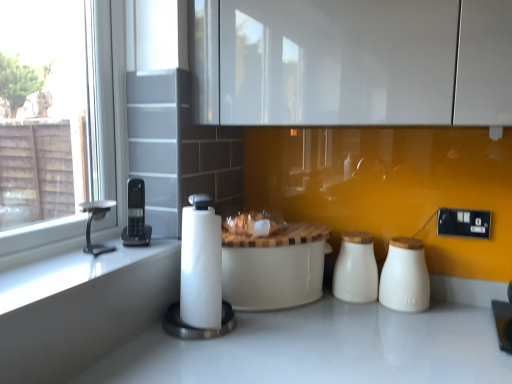
What do you see at coordinates (254, 223) in the screenshot? I see `translucent plastic bag at center` at bounding box center [254, 223].

This screenshot has width=512, height=384. Describe the element at coordinates (274, 267) in the screenshot. I see `white ceramic table at center` at that location.

I want to click on black plastic phone at left, the 1th appliance positioned from the left, so click(x=136, y=215).

Find the location of `black plastic electrical outlet at right`. black plastic electrical outlet at right is located at coordinates (463, 223).

The image size is (512, 384). Find the location of `silver metallic faucet at left`. silver metallic faucet at left is located at coordinates (96, 220).

Measure the distance between white ceramic salt shaker at right, which appears as the first salt shaker when viewed from the right, and camera.

white ceramic salt shaker at right, which appears as the first salt shaker when viewed from the right, is 1.22 meters from camera.

Image resolution: width=512 pixels, height=384 pixels. Describe the element at coordinates (405, 276) in the screenshot. I see `white ceramic salt shaker at right, arranged as the 2th salt shaker when viewed from the left` at that location.

What are the coordinates of `translucent plastic bag at center` in the screenshot? It's located at (254, 223).

Is silver metallic faucet at left located outside white ceramic table at center?

Yes.

At what (x,y) coordinates should I click in order to perform the action: click on table below the silver metallic faucet at left (from the image's perspective). Please return your answer as a coordinate pair (x, y). Looking at the image, I should click on (274, 267).

Is silver metallic faucet at left positioned in front of white ceramic table at center?

Yes, silver metallic faucet at left is closer to the viewer.

From the image's perspective, is silver metallic faucet at left positioned above or below white ceramic table at center?

silver metallic faucet at left is situated higher than white ceramic table at center in the image.

Would you say black plastic electrical outlet at right is part of white ceramic table at center's contents?

Definitely not — black plastic electrical outlet at right is not inside white ceramic table at center.

From the image's perspective, is white ceramic table at center above or below black plastic electrical outlet at right?

Based on their image positions, white ceramic table at center is located beneath black plastic electrical outlet at right.

Is white ceramic table at center closer to the viewer compared to black plastic electrical outlet at right?

Yes, white ceramic table at center is closer to the viewer.

Does white ceramic table at center appear on the right side of black plastic electrical outlet at right?

In fact, white ceramic table at center is to the left of black plastic electrical outlet at right.

Is translucent plastic bag at center not close to white paper towel at center, the first appliance viewed from the right?

No, there isn't a large distance between translucent plastic bag at center and white paper towel at center, the first appliance viewed from the right.

Which appliance is the 1st one when counting from the left side of the translucent plastic bag at center? Please provide its 2D coordinates.

[(200, 277)]

Would you say translucent plastic bag at center is outside white paper towel at center, the first appliance viewed from the right?

translucent plastic bag at center is positioned outside white paper towel at center, the first appliance viewed from the right.

Considering the relative positions of translucent plastic bag at center and white paper towel at center, the 2th appliance when ordered from left to right, in the image provided, is translucent plastic bag at center to the left or to the right of white paper towel at center, the 2th appliance when ordered from left to right,?

Based on their positions, translucent plastic bag at center is located to the right of white paper towel at center, the 2th appliance when ordered from left to right.

Image resolution: width=512 pixels, height=384 pixels. I want to click on food that appears below the black plastic phone at left, the 1th appliance positioned from the left (from the image's perspective), so click(x=254, y=223).

Considering the positions of point (260, 233) and point (133, 226), is point (260, 233) closer or farther from the camera than point (133, 226)?

Point (260, 233).

From a real-world perspective, is translucent plastic bag at center above or below black plastic phone at left, the 1th appliance positioned from the left?

From a real-world perspective, translucent plastic bag at center is physically below black plastic phone at left, the 1th appliance positioned from the left.

Considering the relative sizes of translucent plastic bag at center and black plastic phone at left, the 1th appliance positioned from the left, in the image provided, is translucent plastic bag at center shorter than black plastic phone at left, the 1th appliance positioned from the left,?

Yes, translucent plastic bag at center is shorter than black plastic phone at left, the 1th appliance positioned from the left.

Looking at their sizes, would you say black plastic phone at left, which is the 2th appliance from right to left, is wider or thinner than white ceramic salt shaker at right, arranged as the 2th salt shaker when viewed from the left?

In the image, black plastic phone at left, which is the 2th appliance from right to left, appears to be more narrow than white ceramic salt shaker at right, arranged as the 2th salt shaker when viewed from the left.

Based on the photo, between black plastic phone at left, which is the 2th appliance from right to left, and white ceramic salt shaker at right, which appears as the first salt shaker when viewed from the right, which one has less height?

black plastic phone at left, which is the 2th appliance from right to left.

Is point (143, 189) positioned before point (415, 260)?

That is True.

From the image's perspective, which one is positioned higher, white ceramic table at center or white ceramic salt shaker at right, arranged as the 2th salt shaker when viewed from the left?

white ceramic salt shaker at right, arranged as the 2th salt shaker when viewed from the left, appears higher in the image.

Considering the sizes of white ceramic table at center and white ceramic salt shaker at right, arranged as the 2th salt shaker when viewed from the left, in the image, is white ceramic table at center taller or shorter than white ceramic salt shaker at right, arranged as the 2th salt shaker when viewed from the left,?

Considering their sizes, white ceramic table at center has more height than white ceramic salt shaker at right, arranged as the 2th salt shaker when viewed from the left.

In the scene shown: What's the angular difference between white ceramic table at center and white ceramic salt shaker at right, which appears as the first salt shaker when viewed from the right,'s facing directions?

40.5 degrees separate the facing orientations of white ceramic table at center and white ceramic salt shaker at right, which appears as the first salt shaker when viewed from the right.

Does point (272, 290) appear closer or farther from the camera than point (407, 250)?

Point (272, 290) is closer to the camera than point (407, 250).

In the scene shown: Based on their sizes in the image, would you say black plastic electrical outlet at right is bigger or smaller than white ceramic salt shaker at right, arranged as the 2th salt shaker when viewed from the left?

Considering their sizes, black plastic electrical outlet at right takes up less space than white ceramic salt shaker at right, arranged as the 2th salt shaker when viewed from the left.

Between black plastic electrical outlet at right and white ceramic salt shaker at right, which appears as the first salt shaker when viewed from the right, which one has smaller width?

black plastic electrical outlet at right.

Between point (475, 218) and point (402, 284), which one is positioned in front?

The point (402, 284) is closer to the camera.

Is there a large distance between black plastic electrical outlet at right and white ceramic salt shaker at right, arranged as the 2th salt shaker when viewed from the left?

No, black plastic electrical outlet at right is not far from white ceramic salt shaker at right, arranged as the 2th salt shaker when viewed from the left.

The height and width of the screenshot is (384, 512). What are the coordinates of `table that is behind the silver metallic faucet at left` in the screenshot? It's located at (274, 267).

Locate an element on the screen. This screenshot has height=384, width=512. electric outlet that appears on the right of white ceramic table at center is located at coordinates (463, 223).

Estimate the real-world distances between objects in this image. Which object is closer to white ceramic table at center, white ceramic salt shaker at right, which appears as the first salt shaker when viewed from the right, or white paper towel at center, the first appliance viewed from the right?

Among the two, white paper towel at center, the first appliance viewed from the right, is located nearer to white ceramic table at center.

When comparing their distances from translucent plastic bag at center, does white ceramic table at center or white ceramic salt shaker at center, marked as the first salt shaker in a left-to-right arrangement, seem further?

The object further to translucent plastic bag at center is white ceramic salt shaker at center, marked as the first salt shaker in a left-to-right arrangement.

When comparing their distances from black plastic electrical outlet at right, does black plastic phone at left, which is the 2th appliance from right to left, or silver metallic faucet at left seem closer?

black plastic phone at left, which is the 2th appliance from right to left.

When comparing their distances from black plastic phone at left, which is the 2th appliance from right to left, does white ceramic salt shaker at center, the 2th salt shaker when ordered from right to left, or black plastic electrical outlet at right seem closer?

white ceramic salt shaker at center, the 2th salt shaker when ordered from right to left, lies closer to black plastic phone at left, which is the 2th appliance from right to left, than the other object.

Considering their positions, is white paper towel at center, the first appliance viewed from the right, positioned further to translucent plastic bag at center than black plastic electrical outlet at right?

black plastic electrical outlet at right.

When comparing their distances from silver metallic faucet at left, does white ceramic table at center or white paper towel at center, the first appliance viewed from the right, seem closer?

white paper towel at center, the first appliance viewed from the right, is positioned closer to the anchor silver metallic faucet at left.

Looking at this image, based on their spatial positions, is translucent plastic bag at center or white paper towel at center, the 2th appliance when ordered from left to right, closer to white ceramic table at center?

The object closer to white ceramic table at center is translucent plastic bag at center.

When comparing their distances from black plastic electrical outlet at right, does white paper towel at center, the 2th appliance when ordered from left to right, or black plastic phone at left, which is the 2th appliance from right to left, seem closer?

white paper towel at center, the 2th appliance when ordered from left to right.

This screenshot has width=512, height=384. I want to click on salt shaker situated between translucent plastic bag at center and white ceramic salt shaker at right, arranged as the 2th salt shaker when viewed from the left, from left to right, so click(x=356, y=269).

The width and height of the screenshot is (512, 384). What are the coordinates of `food between silver metallic faucet at left and white ceramic salt shaker at right, which appears as the first salt shaker when viewed from the right, from left to right` in the screenshot? It's located at (254, 223).

Locate an element on the screen. This screenshot has height=384, width=512. salt shaker between silver metallic faucet at left and white ceramic salt shaker at right, arranged as the 2th salt shaker when viewed from the left, in the horizontal direction is located at coordinates (356, 269).

Locate an element on the screen. The height and width of the screenshot is (384, 512). table between silver metallic faucet at left and white ceramic salt shaker at right, which appears as the first salt shaker when viewed from the right is located at coordinates (274, 267).